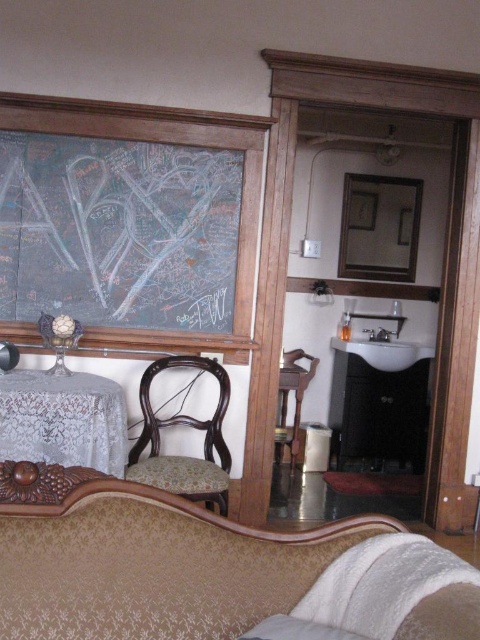
Question: Among these points, which one is nearest to the camera?

Choices:
 (A) (277, 547)
 (B) (228, 468)
 (C) (340, 460)
 (D) (297, 442)

Answer: (A)

Question: Which point appears farthest from the camera in this image?

Choices:
 (A) (7, 515)
 (B) (336, 381)
 (C) (300, 406)
 (D) (252, 266)

Answer: (B)

Question: Is chalkboard at upper left to the left of wooden chair at lower left from the viewer's perspective?

Choices:
 (A) no
 (B) yes

Answer: (B)

Question: Can you confirm if velvet gold couch at lower center is positioned above wooden chair at center?

Choices:
 (A) yes
 (B) no

Answer: (A)

Question: Which of the following is the closest to the observer?

Choices:
 (A) (50, 467)
 (B) (192, 490)
 (C) (280, 424)

Answer: (A)

Question: Is the position of black glossy armoire at center more distant than that of wooden chair at lower left?

Choices:
 (A) yes
 (B) no

Answer: (A)